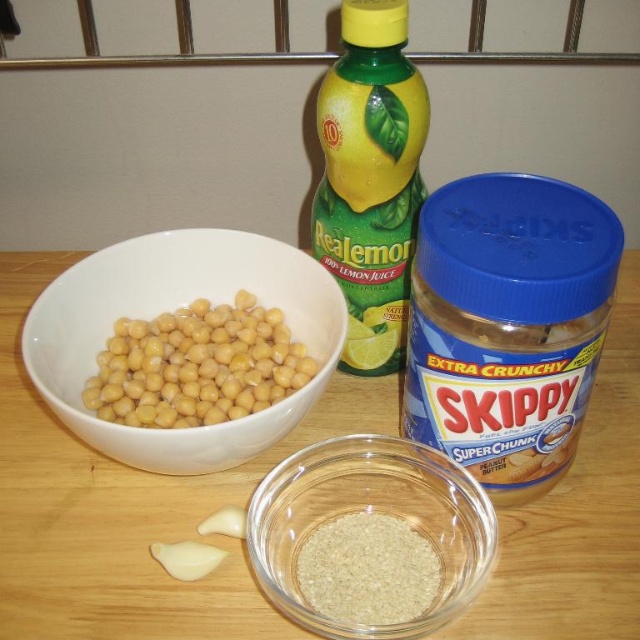
Question: Can you confirm if transparent glass bowl at lower center is positioned to the right of green plastic bottle at center?

Choices:
 (A) no
 (B) yes

Answer: (A)

Question: Is transparent glass bowl at lower center further to the viewer compared to green plastic bottle at center?

Choices:
 (A) yes
 (B) no

Answer: (B)

Question: Which point appears closest to the camera in this image?

Choices:
 (A) (125, 352)
 (B) (460, 474)
 (C) (48, 390)
 (D) (392, 563)

Answer: (B)

Question: Considering the relative positions of transparent glass bowl at lower center and yellow matte chickpeas at left in the image provided, where is transparent glass bowl at lower center located with respect to yellow matte chickpeas at left?

Choices:
 (A) above
 (B) below

Answer: (B)

Question: Which is nearer to the pale yellow/golden translucent garlic at lower left?

Choices:
 (A) yellow matte chickpeas at left
 (B) transparent glass bowl at center

Answer: (B)

Question: Which point is closer to the camera?

Choices:
 (A) (244, 301)
 (B) (307, 536)
 (C) (308, 454)
 (D) (144, 538)

Answer: (C)